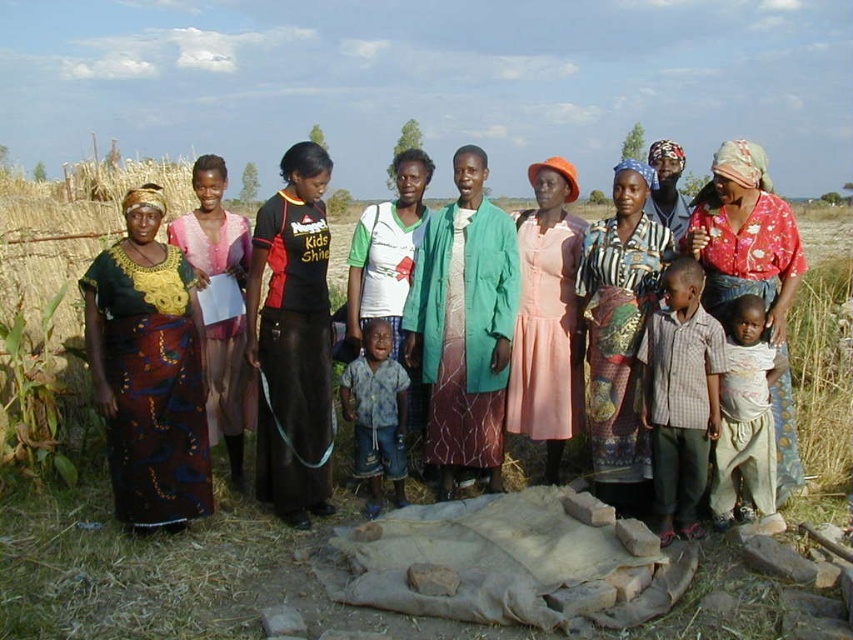
Question: Is dark brown woven fabric at left above light beige cotton shirt at center?

Choices:
 (A) no
 (B) yes

Answer: (B)

Question: Which point appears closest to the camera in this image?

Choices:
 (A) (347, 378)
 (B) (763, 282)
 (C) (726, 182)

Answer: (C)

Question: Is black matte skirt at center positioned in front of floral printed blouse at center?

Choices:
 (A) yes
 (B) no

Answer: (B)

Question: Considering the real-world distances, which object is closest to the striped fabric dress at center?

Choices:
 (A) plaid cotton shirt at center
 (B) black matte skirt at center
 (C) dark brown woven fabric at left
 (D) pink fabric dress at center

Answer: (D)

Question: Which is farther from the plaid cotton shirt at center?

Choices:
 (A) multicolored fabric dress at center
 (B) dark brown woven fabric at left
 (C) light beige cotton shirt at center
 (D) floral printed blouse at center

Answer: (B)

Question: Does pink fabric dress at center appear under light beige cotton shirt at center?

Choices:
 (A) no
 (B) yes

Answer: (A)